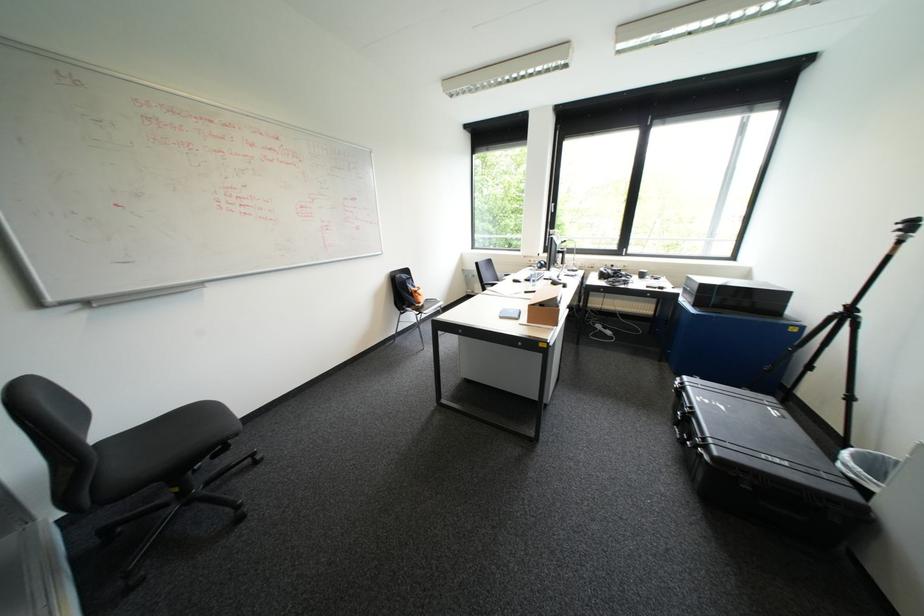
Where would you flip the tripod leg latch? Please return your answer as a coordinate pair (x, y).

(844, 322)